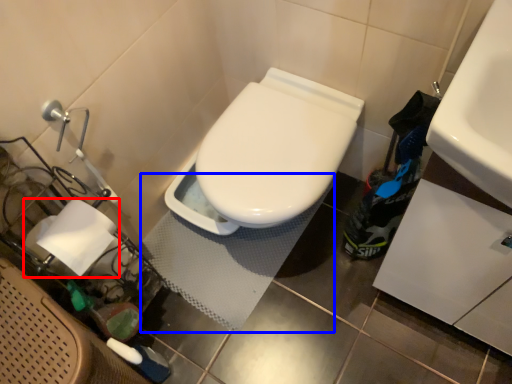
Question: Which object appears farthest to the camera in this image, toilet paper (highlighted by a red box) or bath mat (highlighted by a blue box)?

Choices:
 (A) toilet paper
 (B) bath mat

Answer: (B)